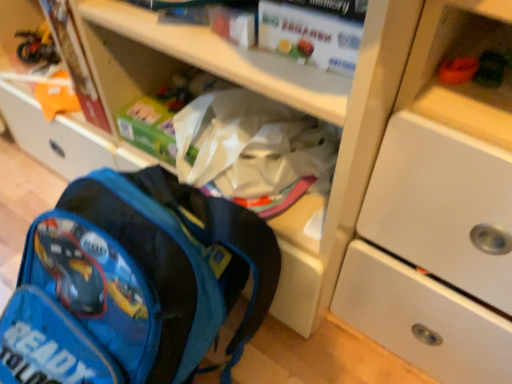
Question: Is blue fabric backpack at lower left oriented away from matte cardboard book at upper left, acting as the first paperback book starting from the left?

Choices:
 (A) no
 (B) yes

Answer: (A)

Question: From the image's perspective, is blue fabric backpack at lower left on matte cardboard book at upper left, marked as the 2th paperback book in a front-to-back arrangement?

Choices:
 (A) no
 (B) yes

Answer: (A)

Question: Is blue fabric backpack at lower left in front of matte cardboard book at upper left, acting as the first paperback book starting from the left?

Choices:
 (A) yes
 (B) no

Answer: (A)

Question: Is blue fabric backpack at lower left not near matte cardboard book at upper left, acting as the first paperback book starting from the left?

Choices:
 (A) yes
 (B) no

Answer: (B)

Question: Does blue fabric backpack at lower left appear on the left side of matte cardboard book at upper left, marked as the 2th paperback book in a front-to-back arrangement?

Choices:
 (A) no
 (B) yes

Answer: (A)

Question: From their relative heights in the image, would you say white matte paper at upper center, the first paperback book when ordered from front to back, is taller or shorter than white matte cabinet at upper right?

Choices:
 (A) tall
 (B) short

Answer: (B)

Question: Is white matte paper at upper center, the first paperback book when ordered from front to back, wider or thinner than white matte cabinet at upper right?

Choices:
 (A) wide
 (B) thin

Answer: (B)

Question: From the image's perspective, is white matte paper at upper center, the first paperback book when ordered from front to back, located above or below white matte cabinet at upper right?

Choices:
 (A) above
 (B) below

Answer: (A)

Question: Is white matte paper at upper center, the 1th paperback book from the right, bigger or smaller than white matte cabinet at upper right?

Choices:
 (A) big
 (B) small

Answer: (B)

Question: In terms of width, does white matte cabinet at upper right look wider or thinner when compared to blue fabric backpack at lower left?

Choices:
 (A) wide
 (B) thin

Answer: (B)

Question: Is white matte cabinet at upper right in front of or behind blue fabric backpack at lower left in the image?

Choices:
 (A) front
 (B) behind

Answer: (A)

Question: Is white matte cabinet at upper right taller or shorter than blue fabric backpack at lower left?

Choices:
 (A) tall
 (B) short

Answer: (A)

Question: Based on their positions, is white matte cabinet at upper right located to the left or right of blue fabric backpack at lower left?

Choices:
 (A) right
 (B) left

Answer: (A)

Question: Considering their positions, is white matte cabinet at upper right located in front of or behind matte cardboard book at upper left, marked as the 2th paperback book in a front-to-back arrangement?

Choices:
 (A) front
 (B) behind

Answer: (A)

Question: In the image, is white matte cabinet at upper right on the left side or the right side of matte cardboard book at upper left, which ranks as the first paperback book in back-to-front order?

Choices:
 (A) right
 (B) left

Answer: (A)